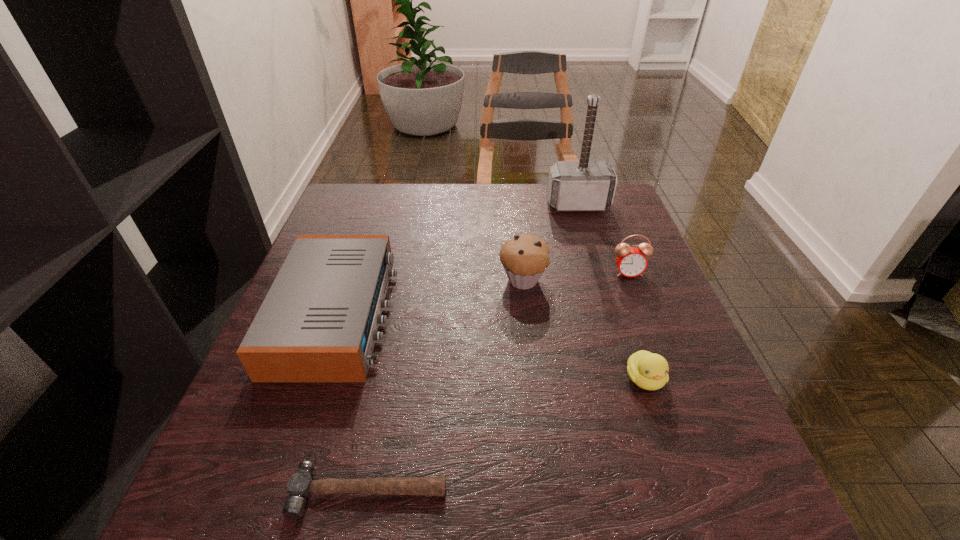
Find the location of a particular element. The image size is (960, 540). the farthest object is located at coordinates (586, 185).

This screenshot has height=540, width=960. I want to click on the right hammer, so click(586, 185).

Locate an element on the screen. the third object from left to right is located at coordinates (525, 257).

The height and width of the screenshot is (540, 960). I want to click on alarm clock, so tap(631, 261).

The height and width of the screenshot is (540, 960). Find the location of `radio receiver`. radio receiver is located at coordinates (319, 321).

Locate an element on the screen. duckling is located at coordinates (649, 371).

Identify the location of the shortest object. (300, 486).

You are a GUI agent. You are given a task and a screenshot of the screen. Output one action in this format:
    pyautogui.click(x=<x>, y=<y>)
    Task: Click on the left hammer
    
    Given the screenshot: What is the action you would take?
    pyautogui.click(x=300, y=486)

The height and width of the screenshot is (540, 960). Find the location of `free space located for striking with the head of the farther hammer`. free space located for striking with the head of the farther hammer is located at coordinates (611, 309).

You are a GUI agent. You are given a task and a screenshot of the screen. Output one action in this format:
    pyautogui.click(x=<x>, y=<y>)
    Task: Click on the free point located 0.240m on the left of the third object from left to right
    The height and width of the screenshot is (540, 960).
    Given the screenshot: What is the action you would take?
    pyautogui.click(x=395, y=280)